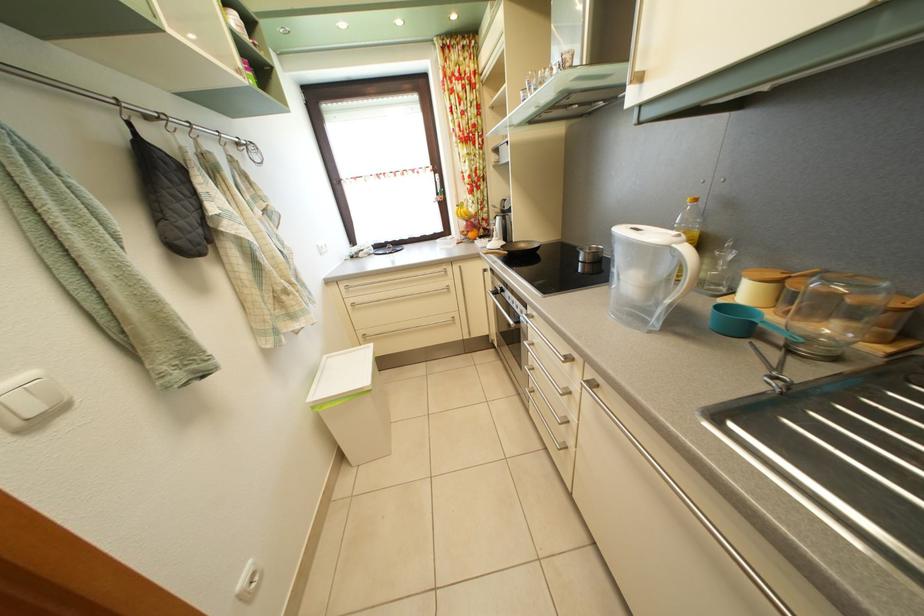
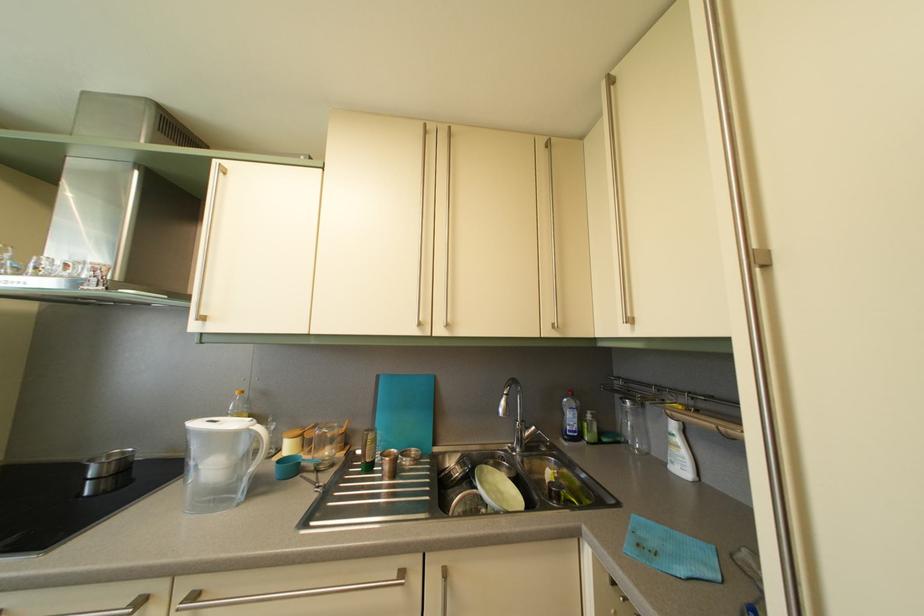
Where in the second image is the point corresponding to point (602, 392) from the first image?

(202, 604)